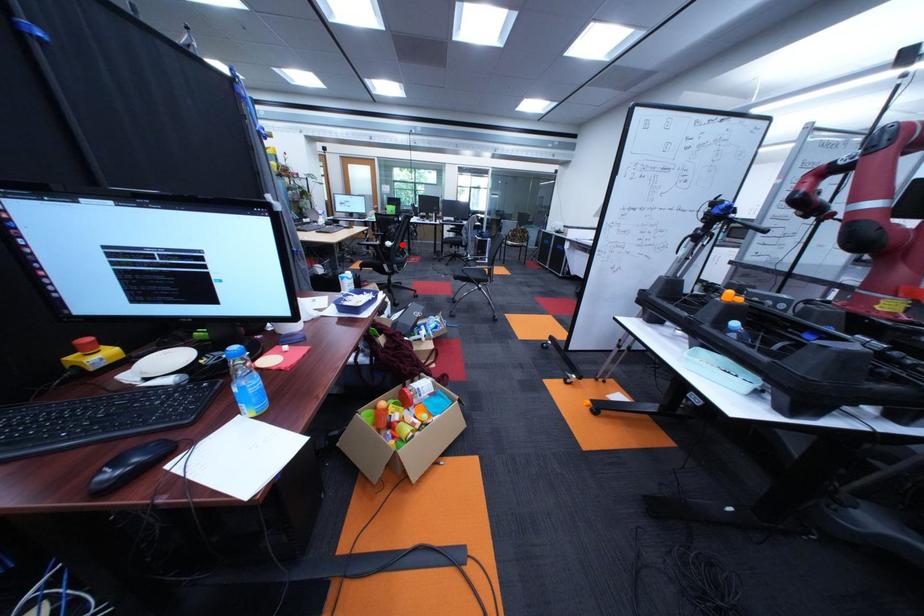
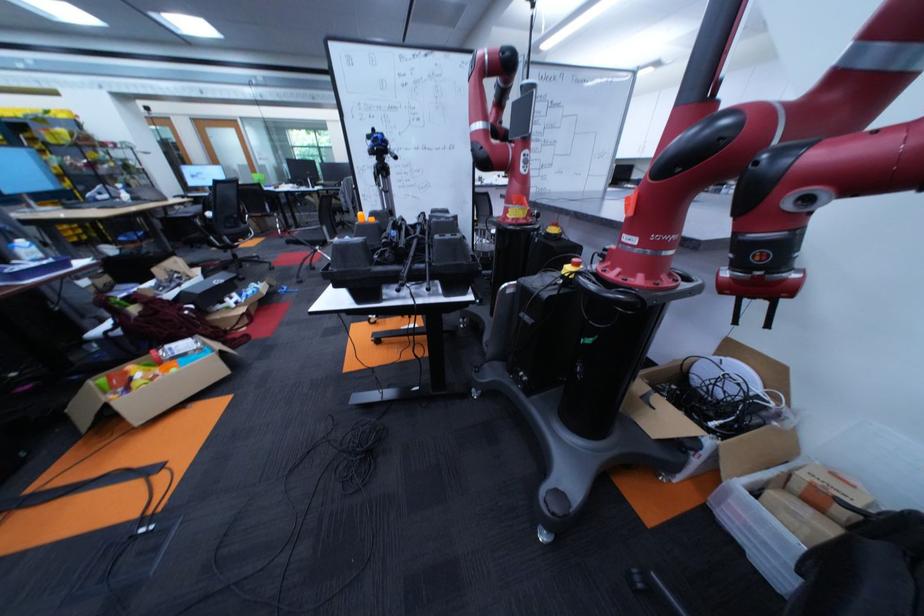
Question: I am providing you with two images of the same scene from different viewpoints. In image1, a red point is highlighted. Considering the same 3D point in image2, which of the following is correct?

Choices:
 (A) It is closer
 (B) It is farther

Answer: (B)